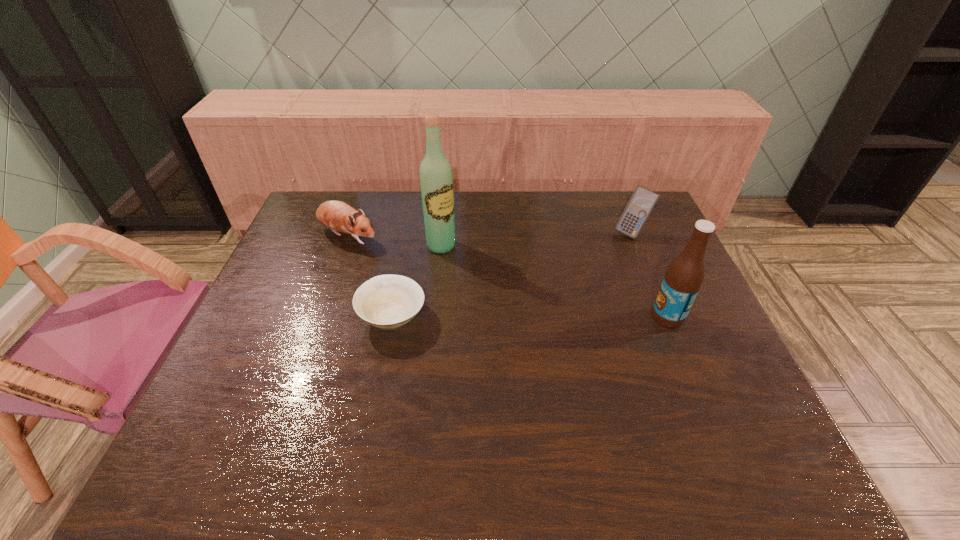
The height and width of the screenshot is (540, 960). In order to click on vacant space that is in between the beer bottle and the third tallest object in this screenshot , I will do `click(650, 274)`.

This screenshot has height=540, width=960. Find the location of `free space between the shortest object and the fourth tallest object`. free space between the shortest object and the fourth tallest object is located at coordinates (370, 277).

Find the location of a particular element. empty location between the second tallest object and the wine bottle is located at coordinates (555, 281).

Locate an element on the screen. This screenshot has height=540, width=960. unoccupied position between the calculator and the beer bottle is located at coordinates (650, 274).

Find the location of a particular element. free spot between the bowl and the wine bottle is located at coordinates (417, 281).

Locate an element on the screen. The image size is (960, 540). free space that is in between the second tallest object and the second shortest object is located at coordinates (508, 276).

Where is `unoccupied area between the beer bottle and the bowl`? The width and height of the screenshot is (960, 540). unoccupied area between the beer bottle and the bowl is located at coordinates (530, 316).

Where is `free space that is in between the wine bottle and the calculator`? The height and width of the screenshot is (540, 960). free space that is in between the wine bottle and the calculator is located at coordinates (537, 239).

Image resolution: width=960 pixels, height=540 pixels. I want to click on the fourth closest object to the second tallest object, so click(x=338, y=216).

Locate an element on the screen. The image size is (960, 540). the second closest object to the third shortest object is located at coordinates (436, 180).